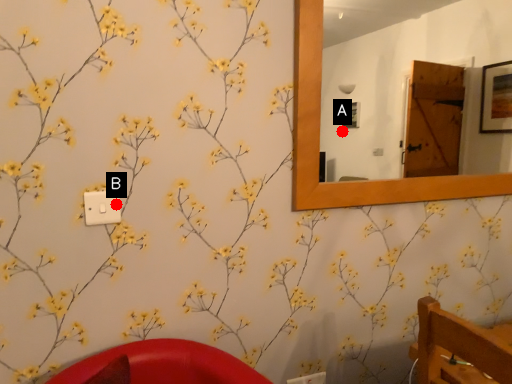
Question: Two points are circled on the image, labeled by A and B beside each circle. Which point is farther from the camera taking this photo?

Choices:
 (A) A is further
 (B) B is further

Answer: (A)